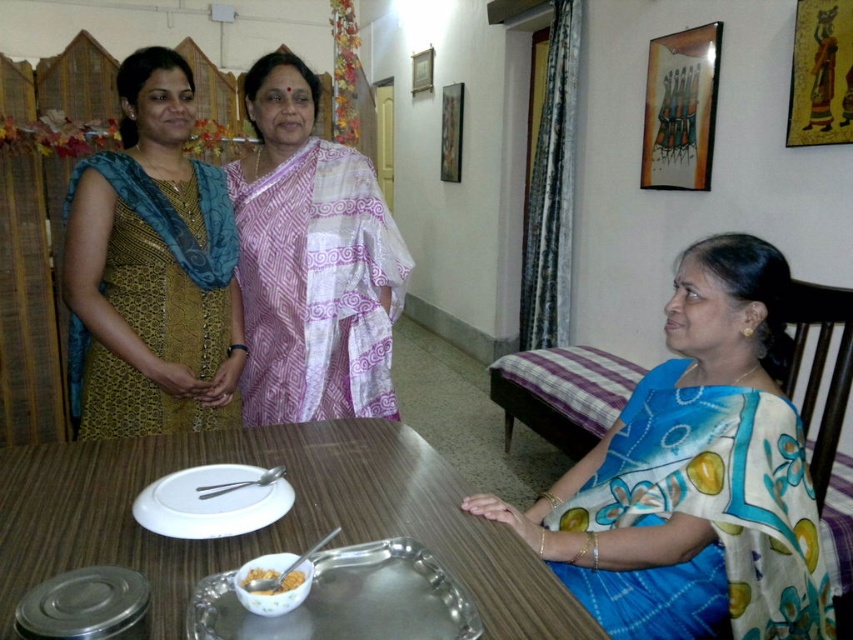
Question: Which object appears closest to the camera in this image?

Choices:
 (A) metallic silver tray at lower center
 (B) silver metallic tray at lower center
 (C) golden crumbly snack at lower center

Answer: (B)

Question: Can you confirm if matte gold dress at left is thinner than silver metallic tray at lower center?

Choices:
 (A) yes
 (B) no

Answer: (B)

Question: Which is nearer to the blue floral saree at right?

Choices:
 (A) white glossy bowl at lower center
 (B) matte gold dress at left
 (C) metallic silver tray at lower center
 (D) white matte plate at lower center

Answer: (C)

Question: Is pink silk saree at center thinner than white glossy bowl at lower center?

Choices:
 (A) yes
 (B) no

Answer: (B)

Question: Is blue floral saree at right to the left of metallic silver tray at lower center from the viewer's perspective?

Choices:
 (A) no
 (B) yes

Answer: (A)

Question: Which point is farther from the camera taking this photo?

Choices:
 (A) (216, 371)
 (B) (268, 593)
 (C) (428, 600)

Answer: (A)